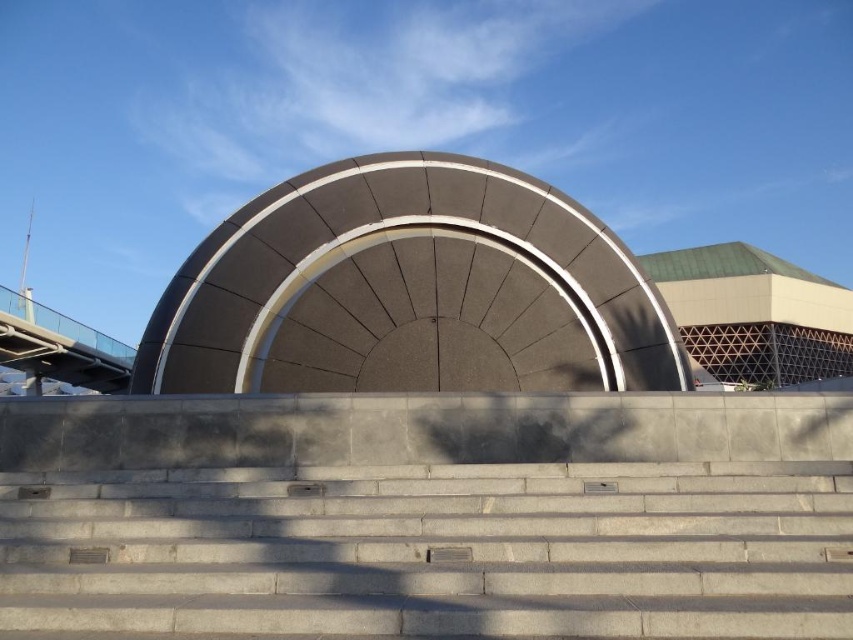
You are standing at the base of the light gray concrete steps leading up to the dome. You want to take a photo of the point marked at coordinates point (735, 525). If your camera can focus on objects up to 5 meters away, will you be able to capture that point clearly?

The point (735, 525) is 4.61 meters away from the camera, which is within the camera focus range of up to 5 meters. Therefore, you can capture the point clearly.

You are standing at the base of the gray concrete stairs at center and want to take a photo of the large dome. If your camera is 12.04 feet away from the stairs, will you be able to capture the entire dome in the frame without moving closer or farther away?

The gray concrete stairs at center and camera are 12.04 feet apart. Since the camera is exactly at that distance, you should be able to capture the entire dome in the frame without needing to adjust your position.

You are standing on the gray concrete stairs at center and want to reach the metallic silver dome at upper right. Which direction should you move to get closer to the dome?

You should move upward along the gray concrete stairs at center since they are located below the metallic silver dome at upper right, indicating that moving upward on the stairs will bring you closer to the dome.